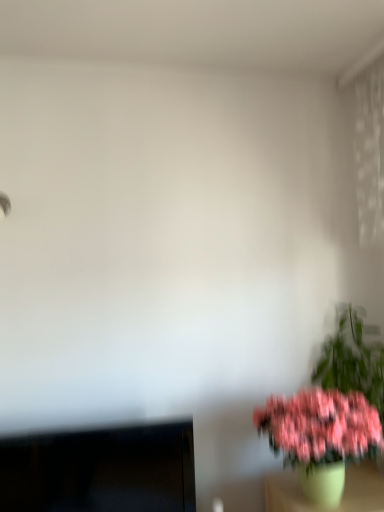
Identify the location of pink matte flower pot at lower right. This screenshot has width=384, height=512. (333, 402).

This screenshot has width=384, height=512. What do you see at coordinates (333, 402) in the screenshot?
I see `pink matte flower pot at lower right` at bounding box center [333, 402].

What do you see at coordinates (100, 470) in the screenshot? I see `black glossy monitor at lower left` at bounding box center [100, 470].

This screenshot has height=512, width=384. In order to click on black glossy monitor at lower left in this screenshot , I will do `click(100, 470)`.

Find the location of `pink matte flower pot at lower right`. pink matte flower pot at lower right is located at coordinates (333, 402).

Does pink matte flower pot at lower right appear on the right side of black glossy monitor at lower left?

Indeed, pink matte flower pot at lower right is positioned on the right side of black glossy monitor at lower left.

Considering the positions of objects pink matte flower pot at lower right and black glossy monitor at lower left in the image provided, who is behind, pink matte flower pot at lower right or black glossy monitor at lower left?

Positioned behind is black glossy monitor at lower left.

Considering the positions of points (340, 495) and (43, 488), is point (340, 495) farther from camera compared to point (43, 488)?

Yes, it is.

From the image's perspective, is pink matte flower pot at lower right located above black glossy monitor at lower left?

Yes.

From a real-world perspective, is pink matte flower pot at lower right above or below black glossy monitor at lower left?

From a real-world perspective, pink matte flower pot at lower right is physically above black glossy monitor at lower left.

Does pink matte flower pot at lower right have a greater width compared to black glossy monitor at lower left?

Indeed, pink matte flower pot at lower right has a greater width compared to black glossy monitor at lower left.

Can you confirm if pink matte flower pot at lower right is shorter than black glossy monitor at lower left?

No, pink matte flower pot at lower right is not shorter than black glossy monitor at lower left.

Looking at the image, does pink matte flower pot at lower right seem bigger or smaller compared to black glossy monitor at lower left?

Considering their sizes, pink matte flower pot at lower right takes up less space than black glossy monitor at lower left.

Does pink matte flower pot at lower right contain black glossy monitor at lower left?

No, black glossy monitor at lower left is not surrounded by pink matte flower pot at lower right.

Are pink matte flower pot at lower right and black glossy monitor at lower left located far from each other?

That's not correct — pink matte flower pot at lower right is a little close to black glossy monitor at lower left.

Is pink matte flower pot at lower right facing towards black glossy monitor at lower left?

No.

Consider the image. Can you tell me how much pink matte flower pot at lower right and black glossy monitor at lower left differ in facing direction?

The angular difference between pink matte flower pot at lower right and black glossy monitor at lower left is 0.000102 degrees.

I want to click on houseplant on the right of the black glossy monitor at lower left, so click(333, 402).

Considering the positions of objects black glossy monitor at lower left and pink matte flower pot at lower right in the image provided, who is more to the left, black glossy monitor at lower left or pink matte flower pot at lower right?

black glossy monitor at lower left is more to the left.

Relative to pink matte flower pot at lower right, is black glossy monitor at lower left in front or behind?

Visually, black glossy monitor at lower left is located behind pink matte flower pot at lower right.

Which is behind, point (92, 464) or point (372, 410)?

Point (92, 464)

From the image's perspective, does black glossy monitor at lower left appear lower than pink matte flower pot at lower right?

Yes, from the image's perspective, black glossy monitor at lower left is below pink matte flower pot at lower right.

From a real-world perspective, is black glossy monitor at lower left above or below pink matte flower pot at lower right?

Clearly, from a real-world perspective, black glossy monitor at lower left is below pink matte flower pot at lower right.

Looking at this image, is black glossy monitor at lower left thinner than pink matte flower pot at lower right?

Yes.

Considering the relative sizes of black glossy monitor at lower left and pink matte flower pot at lower right in the image provided, is black glossy monitor at lower left taller than pink matte flower pot at lower right?

No, black glossy monitor at lower left is not taller than pink matte flower pot at lower right.

Considering the relative sizes of black glossy monitor at lower left and pink matte flower pot at lower right in the image provided, is black glossy monitor at lower left bigger than pink matte flower pot at lower right?

Yes, black glossy monitor at lower left is bigger than pink matte flower pot at lower right.

Which is correct: black glossy monitor at lower left is inside pink matte flower pot at lower right, or outside of it?

black glossy monitor at lower left is not inside pink matte flower pot at lower right, it's outside.

Are black glossy monitor at lower left and pink matte flower pot at lower right far apart?

Actually, black glossy monitor at lower left and pink matte flower pot at lower right are a little close together.

Is pink matte flower pot at lower right at the back of black glossy monitor at lower left?

No, black glossy monitor at lower left is not facing the opposite direction of pink matte flower pot at lower right.

What's the angular difference between black glossy monitor at lower left and pink matte flower pot at lower right's facing directions?

0.000102 degrees.

Image resolution: width=384 pixels, height=512 pixels. In order to click on computer monitor lying behind the pink matte flower pot at lower right in this screenshot , I will do 100,470.

Identify the location of computer monitor behind the pink matte flower pot at lower right. This screenshot has width=384, height=512. (100, 470).

Identify the location of houseplant above the black glossy monitor at lower left (from the image's perspective). (333, 402).